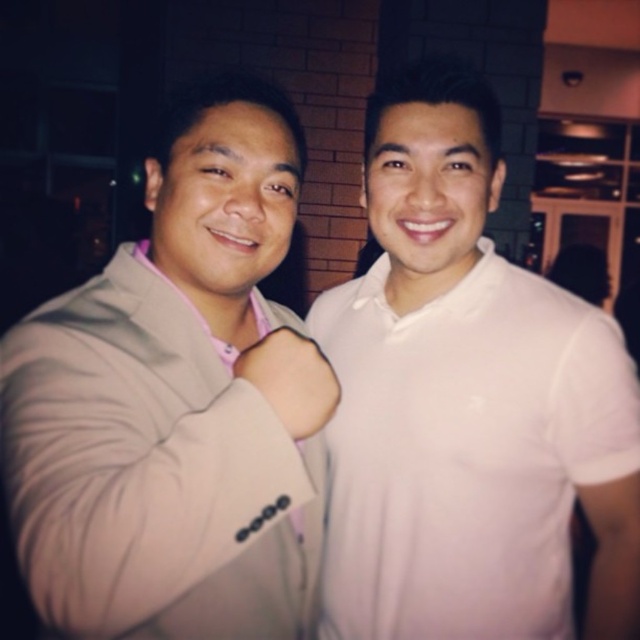
Between point (250, 246) and point (384, 465), which one is positioned behind?

Point (384, 465)

The height and width of the screenshot is (640, 640). I want to click on beige fabric suit at left, so click(177, 401).